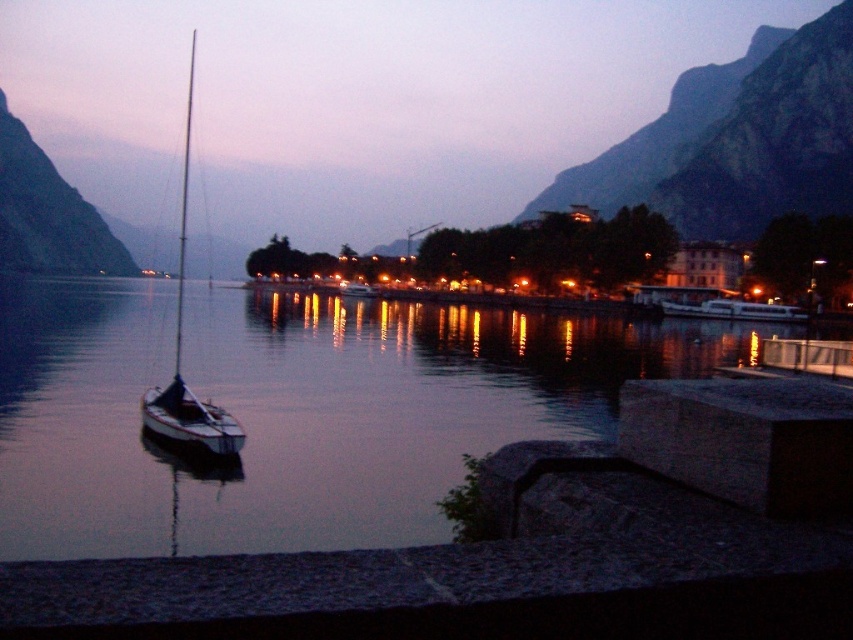
Who is more forward, (821, 192) or (3, 198)?

Point (821, 192) is in front.

Can you confirm if rugged stone mountain at upper right is shorter than green rock mountain at left?

No, rugged stone mountain at upper right is not shorter than green rock mountain at left.

Describe the element at coordinates (738, 140) in the screenshot. This screenshot has height=640, width=853. I see `rugged stone mountain at upper right` at that location.

Identify the location of rugged stone mountain at upper right. (738, 140).

Does smooth water at center have a greater width compared to rugged stone mountain at upper right?

Yes, smooth water at center is wider than rugged stone mountain at upper right.

Which of these two, smooth water at center or rugged stone mountain at upper right, stands taller?

rugged stone mountain at upper right is taller.

Is point (56, 416) positioned behind point (762, 173)?

No, it is in front of (762, 173).

Identify the location of smooth water at center. The width and height of the screenshot is (853, 640). (293, 410).

Does rugged stone mountain at upper right have a lesser height compared to white matte sailboat at left?

Yes.

Between rugged stone mountain at upper right and white matte sailboat at left, which one has less height?

rugged stone mountain at upper right is shorter.

Does point (776, 92) come in front of point (189, 403)?

No, (776, 92) is behind (189, 403).

Locate an element on the screen. The width and height of the screenshot is (853, 640). rugged stone mountain at upper right is located at coordinates (738, 140).